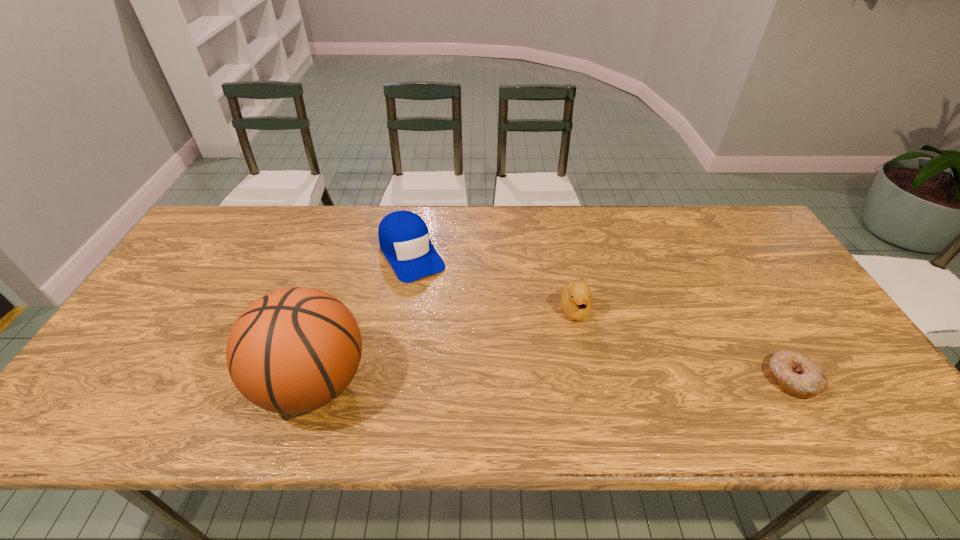
Locate an element on the screen. This screenshot has height=540, width=960. free region at the right edge is located at coordinates (765, 253).

I want to click on vacant point at the far left corner, so click(x=193, y=243).

In the image, there is a desktop. Where is `vacant space at the far right corner`? vacant space at the far right corner is located at coordinates (747, 246).

The width and height of the screenshot is (960, 540). I want to click on vacant area that lies between the duckling and the tallest object, so click(x=444, y=346).

What are the coordinates of `free spot between the second farthest object and the shortest object` in the screenshot? It's located at (684, 345).

At what (x,y) coordinates should I click in order to perform the action: click on free space between the tallest object and the duckling. Please return your answer as a coordinate pair (x, y). This screenshot has width=960, height=540. Looking at the image, I should click on (444, 346).

This screenshot has width=960, height=540. Identify the location of free space between the third nearest object and the baseball cap. (493, 282).

I want to click on empty space that is in between the tallest object and the shortest object, so click(552, 381).

You are a GUI agent. You are given a task and a screenshot of the screen. Output one action in this format:
    pyautogui.click(x=<x>, y=<y>)
    Task: Click on the free spot between the second farthest object and the farthest object
    This screenshot has width=960, height=540.
    Given the screenshot: What is the action you would take?
    pyautogui.click(x=493, y=282)

Locate an element on the screen. This screenshot has height=540, width=960. free space between the rightmost object and the basketball is located at coordinates (552, 381).